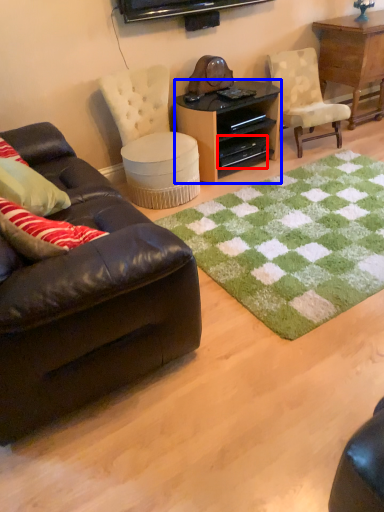
Question: Which of the following is the farthest to the observer, drawer (highlighted by a red box) or desk (highlighted by a blue box)?

Choices:
 (A) drawer
 (B) desk

Answer: (A)